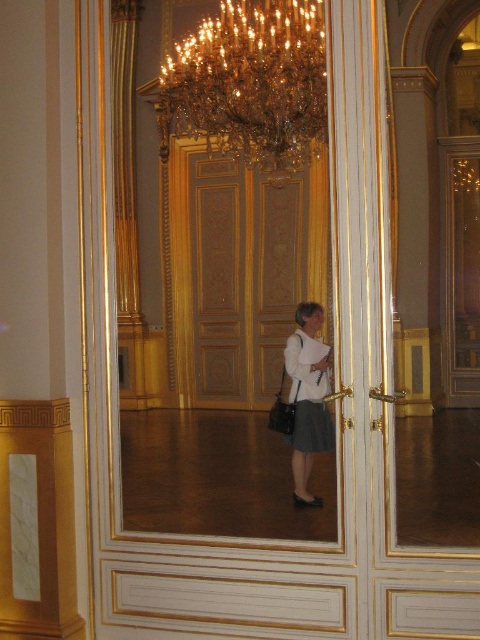
Question: Does wooden paneling at center have a lesser width compared to white fabric blouse at center?

Choices:
 (A) no
 (B) yes

Answer: (A)

Question: Which point is farther to the camera?

Choices:
 (A) white fabric blouse at center
 (B) wooden paneling at center
 (C) gold crystal chandelier at upper center

Answer: (B)

Question: Does wooden paneling at center appear on the right side of white fabric blouse at center?

Choices:
 (A) no
 (B) yes

Answer: (A)

Question: Does wooden paneling at center appear over white fabric blouse at center?

Choices:
 (A) yes
 (B) no

Answer: (A)

Question: Which of the following is the farthest from the observer?

Choices:
 (A) (310, 324)
 (B) (205, 182)

Answer: (B)

Question: Based on their relative distances, which object is nearer to the gold crystal chandelier at upper center?

Choices:
 (A) wooden paneling at center
 (B) white fabric blouse at center

Answer: (A)